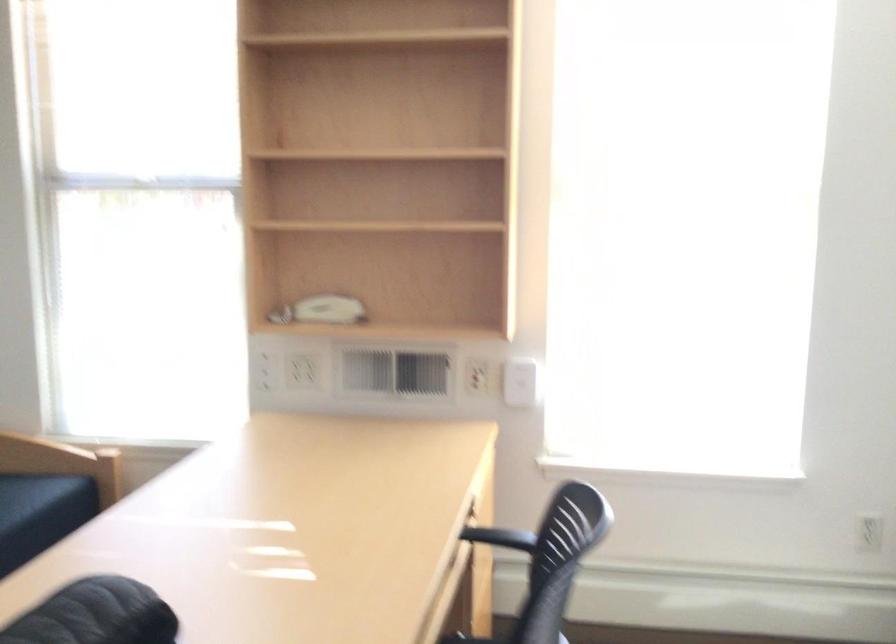
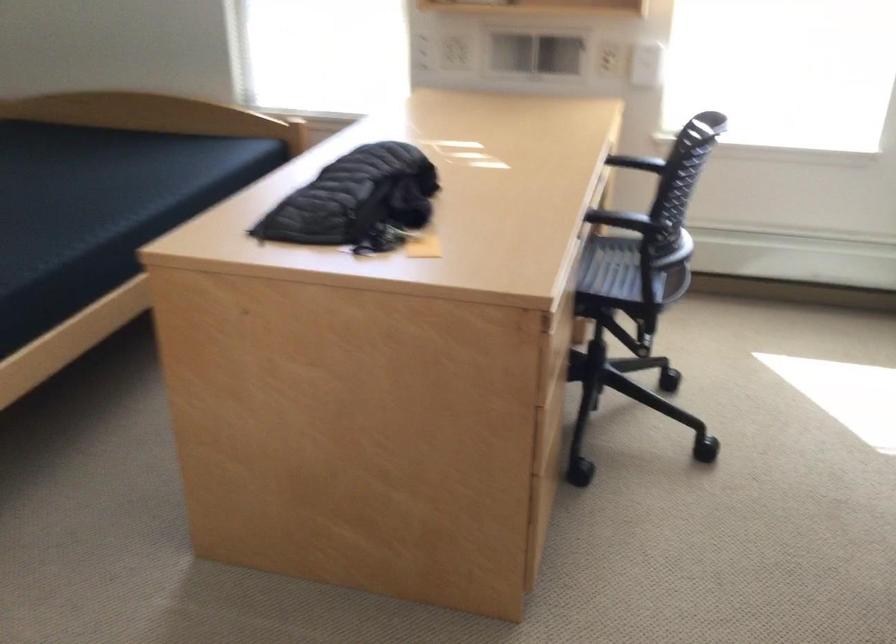
Find the pixel in the second image that matches pixel 483 384 in the first image.

(616, 62)